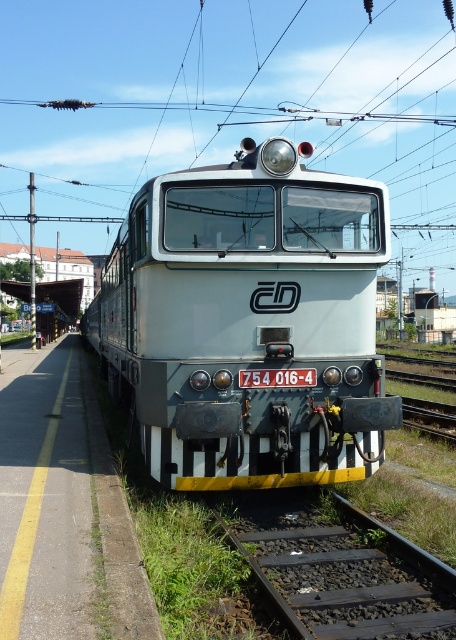
Can you confirm if white glossy train at center is positioned above black metal train track at lower center?

Indeed, white glossy train at center is positioned over black metal train track at lower center.

Is white glossy train at center smaller than black metal train track at lower center?

Incorrect, white glossy train at center is not smaller in size than black metal train track at lower center.

Between point (296, 397) and point (418, 412), which one is positioned behind?

Positioned behind is point (418, 412).

In order to click on white glossy train at center in this screenshot , I will do `click(248, 323)`.

Between white glossy train at center and black metal train track at lower right, which one is positioned higher?

white glossy train at center is above.

Does point (283, 198) come closer to viewer compared to point (416, 609)?

No, (283, 198) is behind (416, 609).

Between point (274, 253) and point (280, 580), which one is positioned behind?

Positioned behind is point (274, 253).

Image resolution: width=456 pixels, height=640 pixels. I want to click on white glossy train at center, so click(248, 323).

Between black metal train track at lower right and black metal train track at lower center, which one appears on the left side from the viewer's perspective?

Positioned to the left is black metal train track at lower right.

Does black metal train track at lower right have a lesser width compared to black metal train track at lower center?

Yes.

Between point (368, 522) and point (445, 419), which one is positioned in front?

Point (368, 522)

The image size is (456, 640). Identify the location of black metal train track at lower right. (341, 570).